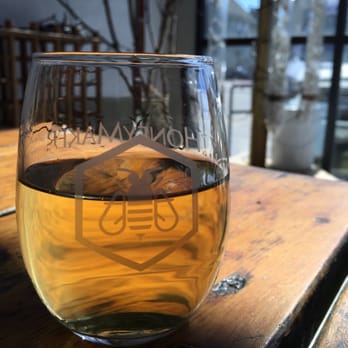
In order to click on white colored wall in this screenshot , I will do [91, 13].